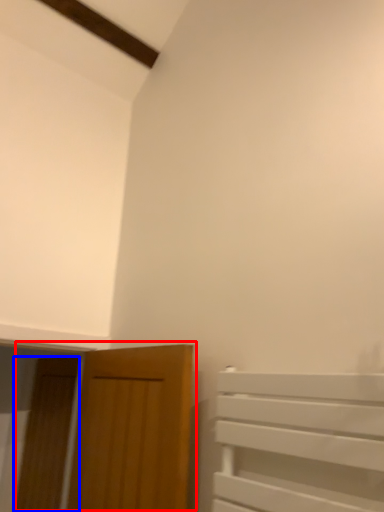
Question: Among these objects, which one is nearest to the camera, door (highlighted by a red box) or door (highlighted by a blue box)?

Choices:
 (A) door
 (B) door

Answer: (A)